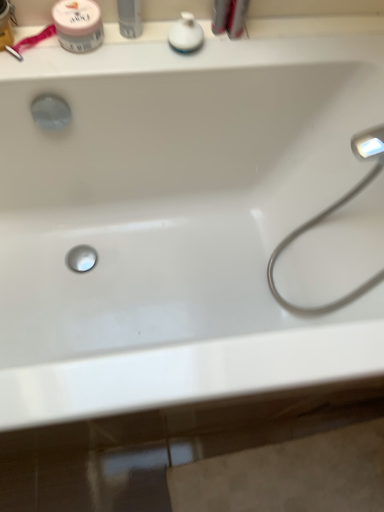
At what (x,y) coordinates should I click in order to perform the action: click on vacant space in front of white glossy spray can at upper center, which is the second toiletry from right to left. Please return your answer as a coordinate pair (x, y). Image resolution: width=384 pixels, height=512 pixels. Looking at the image, I should click on (113, 64).